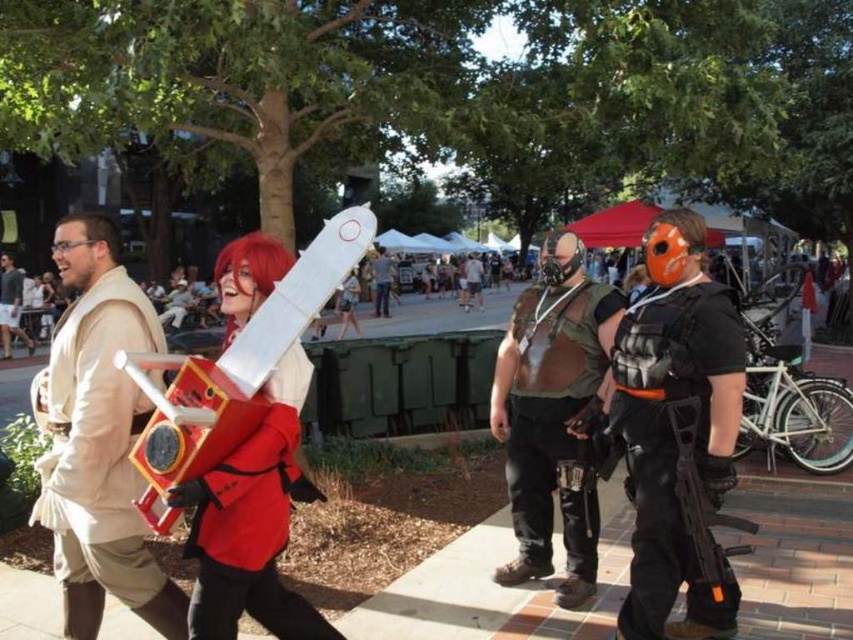
You are a photographer positioned at the center of the scene. You want to take a photo that includes both the black matte vest at right and the red fabric jacket at center. Given that your camera has a maximum focal length allowing it to capture objects within a 5 feet range, will you be able to include both in the same frame?

The distance between the black matte vest at right and the red fabric jacket at center is 4.36 feet, which is within the 5 feet range. Therefore, you can include both in the same frame.

You are standing at the center of the park and want to locate the black matte vest at right. Which direction should you turn to face it?

The black matte vest at right is located at point 0.694 on the x axis and 0.794 on the y axis. Since the x coordinate is greater than 0.5, you should turn to your right to face it.